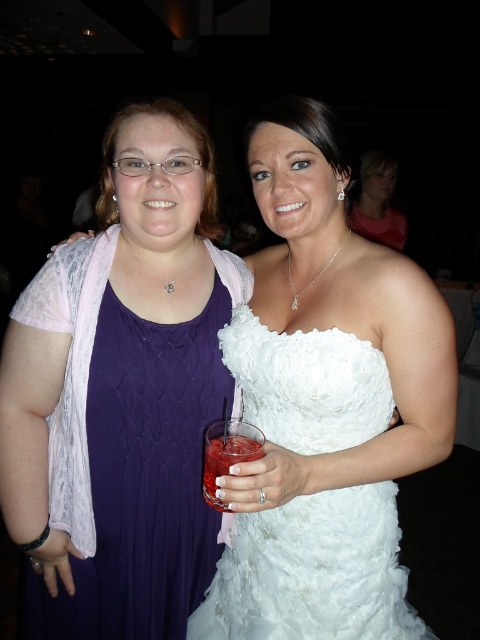
You are at a party and want to take a photo of the matte purple dress at center without the translucent glass drink at center appearing in the frame. How should you adjust your camera angle?

Since the matte purple dress at center is located above the translucent glass drink at center, you can lower your camera angle to focus on the dress while avoiding the drink below it.

You are standing at the point marked as point (96, 444) and want to greet someone who is 3.38 feet away from you. Can you reach them without moving?

Yes, because the distance between you and the viewer is exactly 3.38 feet, so you can reach them without moving.

You are a photographer at a social event. You need to arrange the purple knit dress at left and the white lace dress at center in a way that the smaller dress is placed closer to the camera to maintain visual balance. Which dress should be moved closer to the camera?

The purple knit dress at left has a smaller size compared to the white lace dress at center, so to maintain visual balance, the purple knit dress at left should be moved closer to the camera.